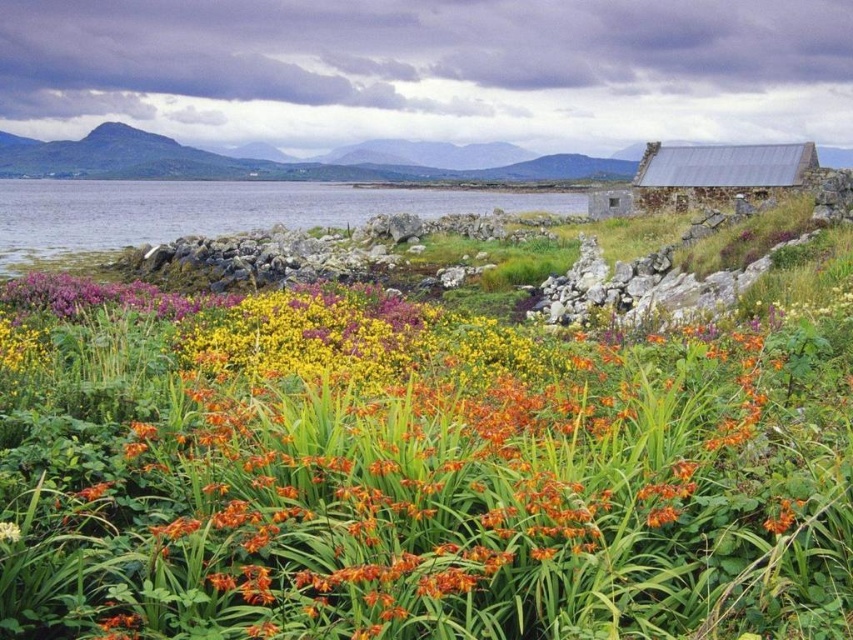
Question: Can you confirm if orange grass at center is positioned to the right of clear water at center?

Choices:
 (A) yes
 (B) no

Answer: (A)

Question: Which point is farther to the camera?

Choices:
 (A) metallic gray hut at upper right
 (B) clear water at center

Answer: (A)

Question: Which point is closer to the camera?

Choices:
 (A) metallic gray hut at upper right
 (B) clear water at center
 (C) orange grass at center

Answer: (C)

Question: Is clear water at center to the right of metallic gray hut at upper right from the viewer's perspective?

Choices:
 (A) no
 (B) yes

Answer: (A)

Question: Among these points, which one is farthest from the camera?

Choices:
 (A) (368, 364)
 (B) (461, 202)
 (C) (740, 148)

Answer: (B)

Question: Does clear water at center appear under metallic gray hut at upper right?

Choices:
 (A) yes
 (B) no

Answer: (B)